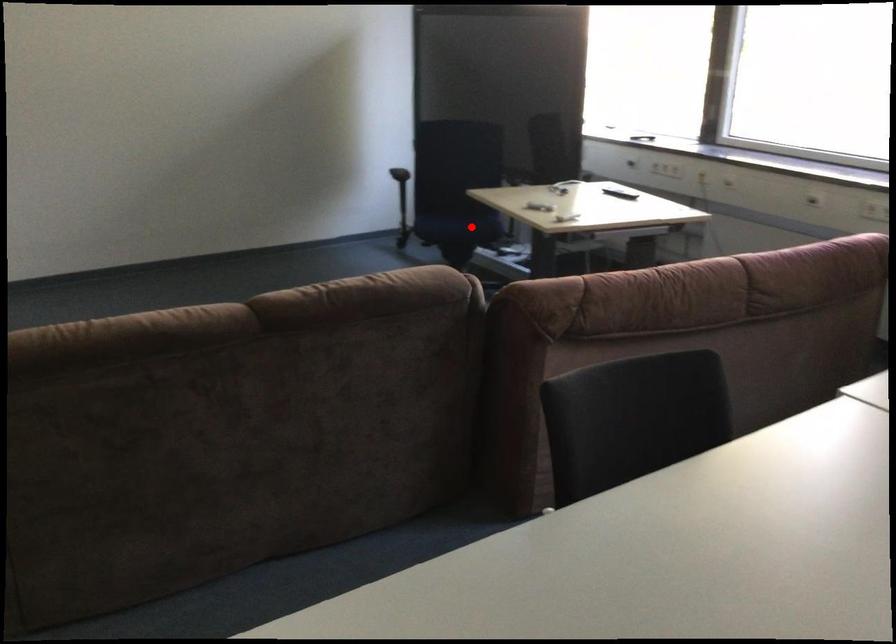
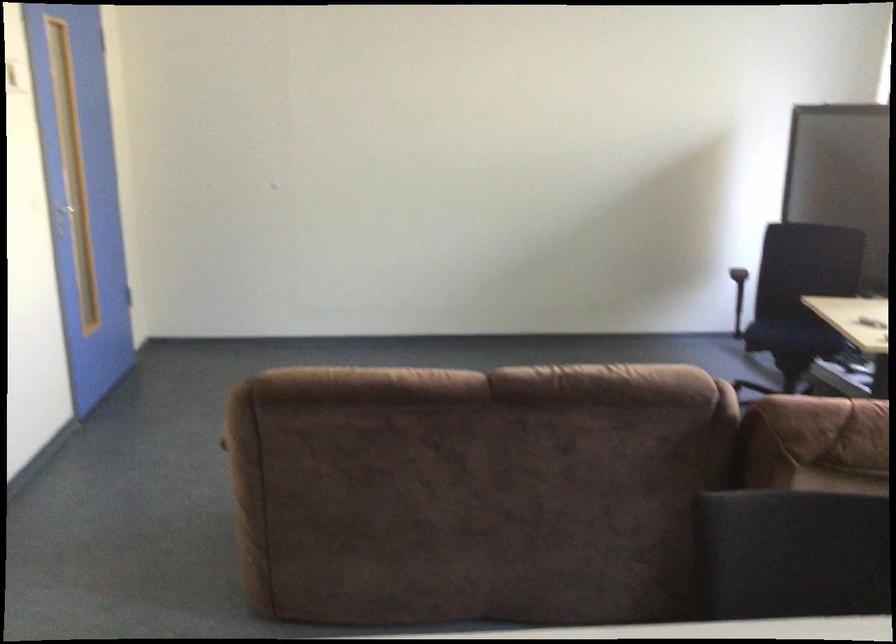
The point at the highlighted location is marked in the first image. Where is the corresponding point in the second image?

(793, 337)